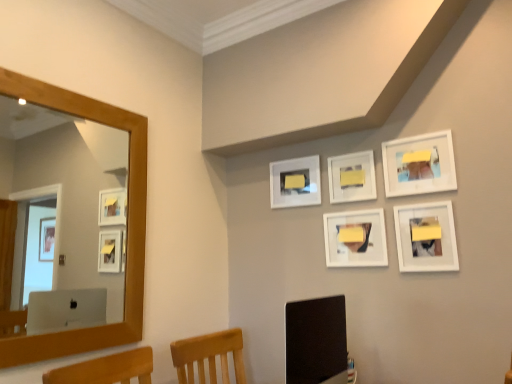
Question: Is white matte picture frame at lower right, the first picture frame positioned from the right, at the left side of matte black monitor at lower center?

Choices:
 (A) no
 (B) yes

Answer: (A)

Question: Does white matte picture frame at lower right, the first picture frame positioned from the right, appear on the right side of matte black monitor at lower center?

Choices:
 (A) yes
 (B) no

Answer: (A)

Question: From a real-world perspective, is white matte picture frame at lower right, the 5th picture frame viewed from the left, under matte black monitor at lower center?

Choices:
 (A) yes
 (B) no

Answer: (B)

Question: Does white matte picture frame at lower right, the 5th picture frame viewed from the left, have a lesser width compared to matte black monitor at lower center?

Choices:
 (A) yes
 (B) no

Answer: (A)

Question: Is there a large distance between white matte picture frame at lower right, the 5th picture frame viewed from the left, and matte black monitor at lower center?

Choices:
 (A) no
 (B) yes

Answer: (A)

Question: Looking at their shapes, would you say white matte picture frame at center, marked as the fourth picture frame in a right-to-left arrangement, is wider or thinner than wooden mirror at left?

Choices:
 (A) thin
 (B) wide

Answer: (B)

Question: In the image, is white matte picture frame at center, marked as the fourth picture frame in a right-to-left arrangement, on the left side or the right side of wooden mirror at left?

Choices:
 (A) left
 (B) right

Answer: (B)

Question: Is white matte picture frame at center, marked as the fourth picture frame in a right-to-left arrangement, taller or shorter than wooden mirror at left?

Choices:
 (A) short
 (B) tall

Answer: (A)

Question: Which is correct: white matte picture frame at center, which is the 2th picture frame from left to right, is inside wooden mirror at left, or outside of it?

Choices:
 (A) inside
 (B) outside

Answer: (B)

Question: Is white matte picture frame at upper center, which is the first picture frame in left-to-right order, to the left or to the right of matte black monitor at lower center in the image?

Choices:
 (A) left
 (B) right

Answer: (B)

Question: Is white matte picture frame at upper center, which is the first picture frame in left-to-right order, wider or thinner than matte black monitor at lower center?

Choices:
 (A) thin
 (B) wide

Answer: (A)

Question: Considering the positions of white matte picture frame at upper center, which is the first picture frame in left-to-right order, and matte black monitor at lower center in the image, is white matte picture frame at upper center, which is the first picture frame in left-to-right order, taller or shorter than matte black monitor at lower center?

Choices:
 (A) tall
 (B) short

Answer: (B)

Question: In the image, is white matte picture frame at upper center, which is the first picture frame in left-to-right order, positioned in front of or behind matte black monitor at lower center?

Choices:
 (A) behind
 (B) front

Answer: (A)

Question: In terms of height, does white matte picture frame at upper right, acting as the fourth picture frame starting from the left, look taller or shorter compared to white matte picture frame at upper center, which is the first picture frame in left-to-right order?

Choices:
 (A) tall
 (B) short

Answer: (A)

Question: From the image's perspective, is white matte picture frame at upper right, which is the 2th picture frame in right-to-left order, positioned above or below white matte picture frame at upper center, the fifth picture frame viewed from the right?

Choices:
 (A) above
 (B) below

Answer: (A)